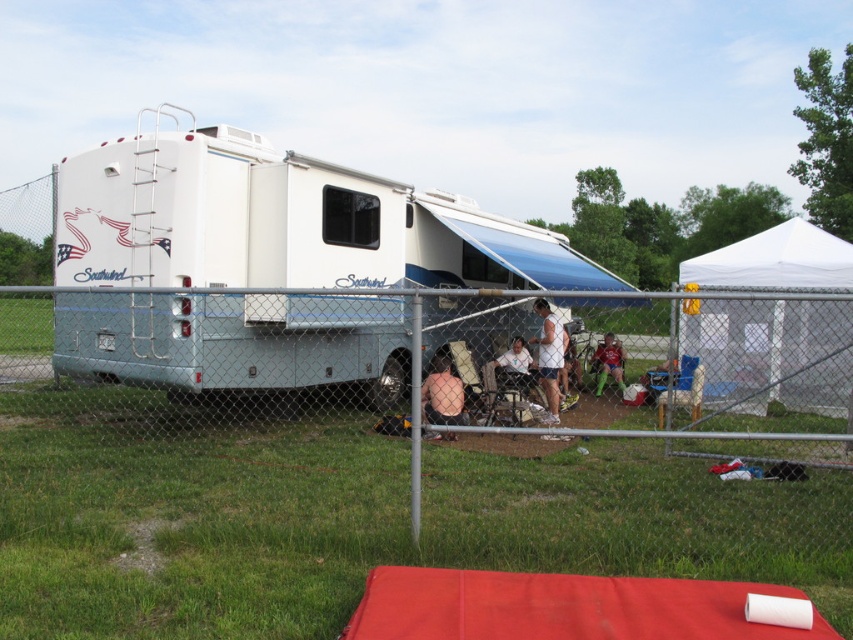
Question: Which object is the closest to the smooth skin at center?

Choices:
 (A) white fabric tent at right
 (B) white glossy recreational vehicle at center

Answer: (A)

Question: Is white glossy recreational vehicle at center below smooth skin at center?

Choices:
 (A) yes
 (B) no

Answer: (B)

Question: Can you confirm if white fabric tent at right is bigger than green mesh shorts at center?

Choices:
 (A) yes
 (B) no

Answer: (A)

Question: Is white fabric tent at right to the left of smooth skin at center from the viewer's perspective?

Choices:
 (A) no
 (B) yes

Answer: (A)

Question: Estimate the real-world distances between objects in this image. Which object is farther from the white glossy recreational vehicle at center?

Choices:
 (A) smooth skin at center
 (B) white fabric tent at right

Answer: (B)

Question: Which object is the farthest from the green mesh shorts at center?

Choices:
 (A) white glossy recreational vehicle at center
 (B) metal chain-link fence at center
 (C) white fabric shirt at center

Answer: (A)